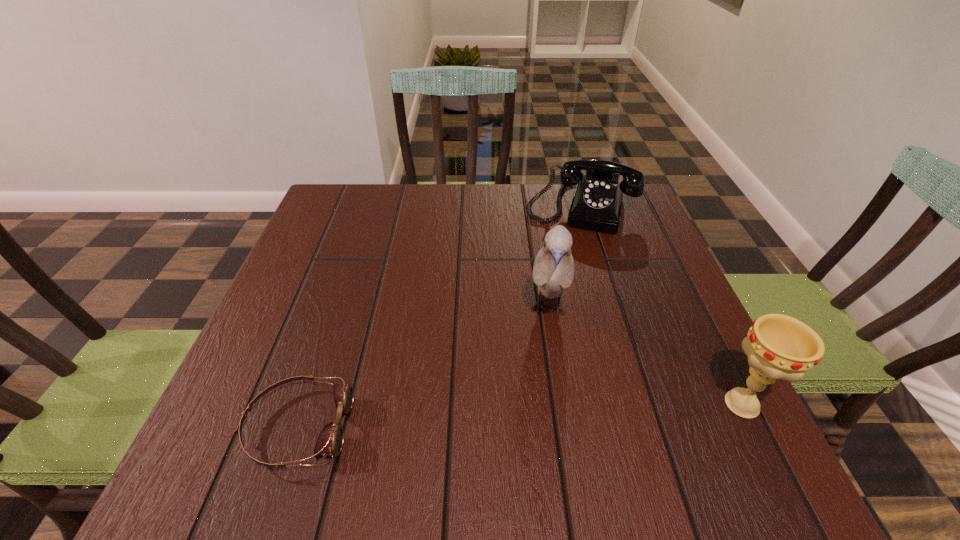
At what (x,y) coordinates should I click in order to perform the action: click on object located at the near left corner. Please return your answer as a coordinate pair (x, y). Looking at the image, I should click on (330, 440).

Locate an element on the screen. object at the far right corner is located at coordinates (597, 201).

Image resolution: width=960 pixels, height=540 pixels. What are the coordinates of `object at the near right corner` in the screenshot? It's located at (778, 346).

Image resolution: width=960 pixels, height=540 pixels. Find the location of `vacant region at the far edge`. vacant region at the far edge is located at coordinates (467, 196).

Identify the location of vacant space at the left edge. (336, 314).

Find the location of a particular element. The image size is (960, 540). free region at the right edge of the desktop is located at coordinates (669, 282).

Locate an element on the screen. The width and height of the screenshot is (960, 540). vacant space at the far left corner of the desktop is located at coordinates (335, 217).

The image size is (960, 540). In order to click on vacant space at the near left corner of the desktop in this screenshot , I will do `click(230, 409)`.

At what (x,y) coordinates should I click in order to perform the action: click on vacant space at the far right corner of the desktop. Please return your answer as a coordinate pair (x, y). Looking at the image, I should click on (644, 222).

Find the location of a particular element. Image resolution: width=960 pixels, height=540 pixels. vacant space at the near right corner is located at coordinates (738, 424).